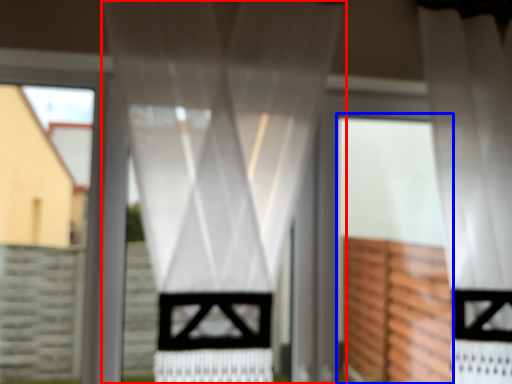
Question: Among these objects, which one is nearest to the camera, curtain (highlighted by a red box) or screen door (highlighted by a blue box)?

Choices:
 (A) curtain
 (B) screen door

Answer: (A)